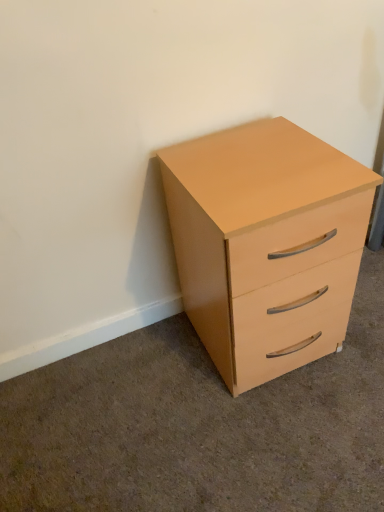
At what (x,y) coordinates should I click in order to perform the action: click on blank space situated above matte wood chest of drawers at lower right (from a real-world perspective). Please return your answer as a coordinate pair (x, y). Looking at the image, I should click on (252, 143).